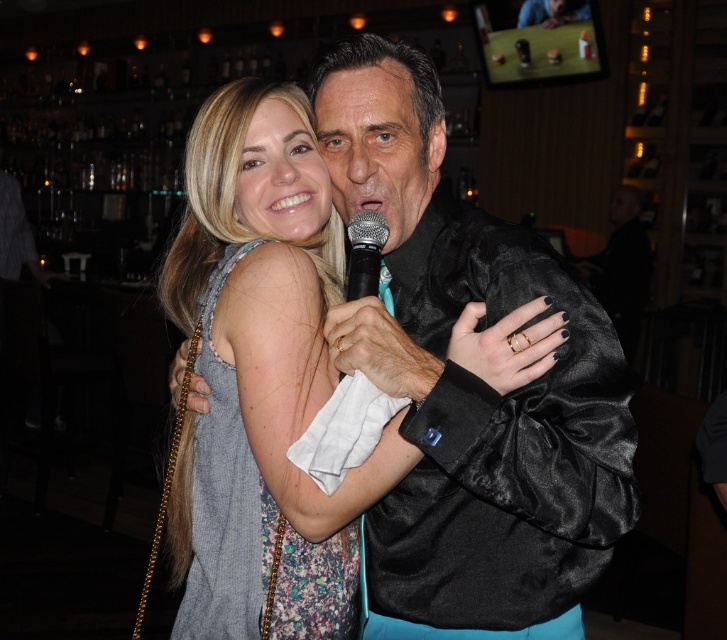
Question: Among these objects, which one is nearest to the camera?

Choices:
 (A) silver metallic microphone at center
 (B) floral fabric dress at center

Answer: (A)

Question: Which of the following is the farthest from the observer?

Choices:
 (A) 566,298
 (B) 286,593

Answer: (B)

Question: Among these points, which one is nearest to the camera?

Choices:
 (A) (293, 602)
 (B) (373, 257)

Answer: (B)

Question: Does satin black jacket at center have a larger size compared to floral fabric dress at center?

Choices:
 (A) no
 (B) yes

Answer: (B)

Question: Does satin black jacket at center have a lesser width compared to floral fabric dress at center?

Choices:
 (A) yes
 (B) no

Answer: (B)

Question: Is floral fabric dress at center to the right of silver metallic microphone at center from the viewer's perspective?

Choices:
 (A) yes
 (B) no

Answer: (B)